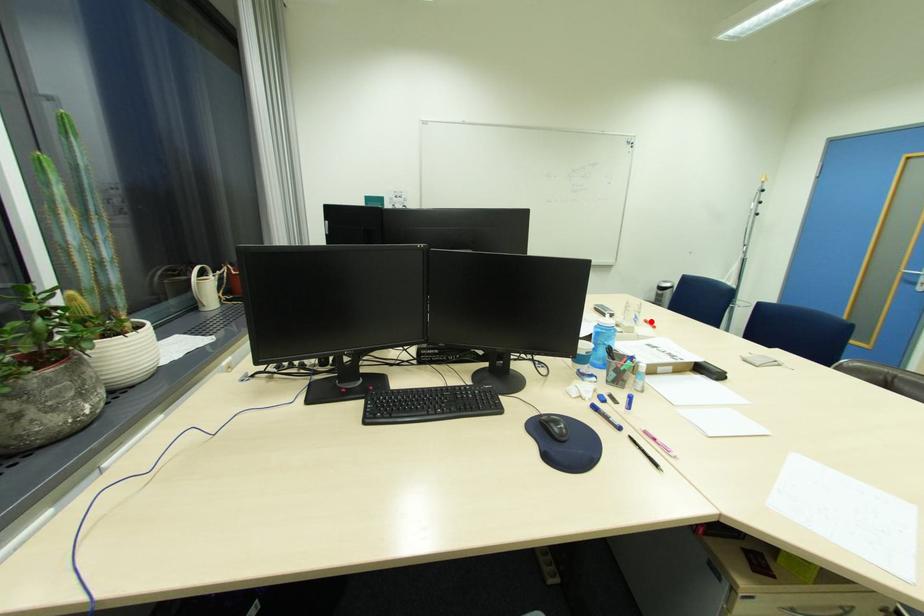
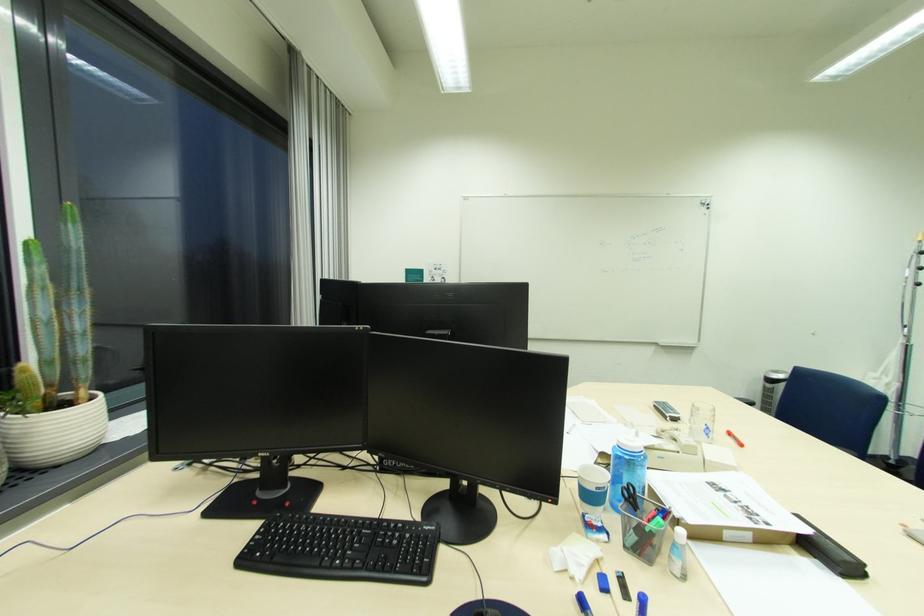
Find the pixel in the second image that matches the highlighted location in the first image.

(736, 435)